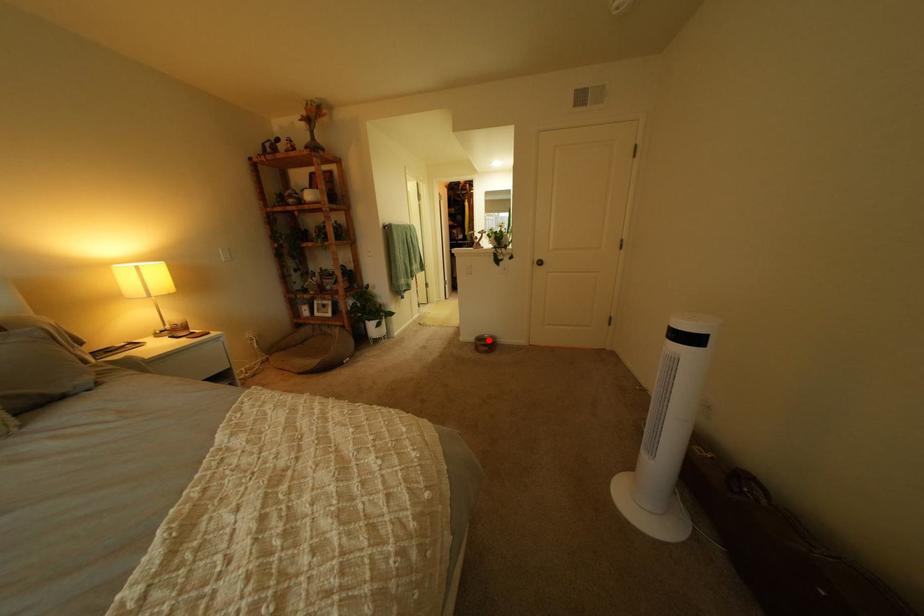
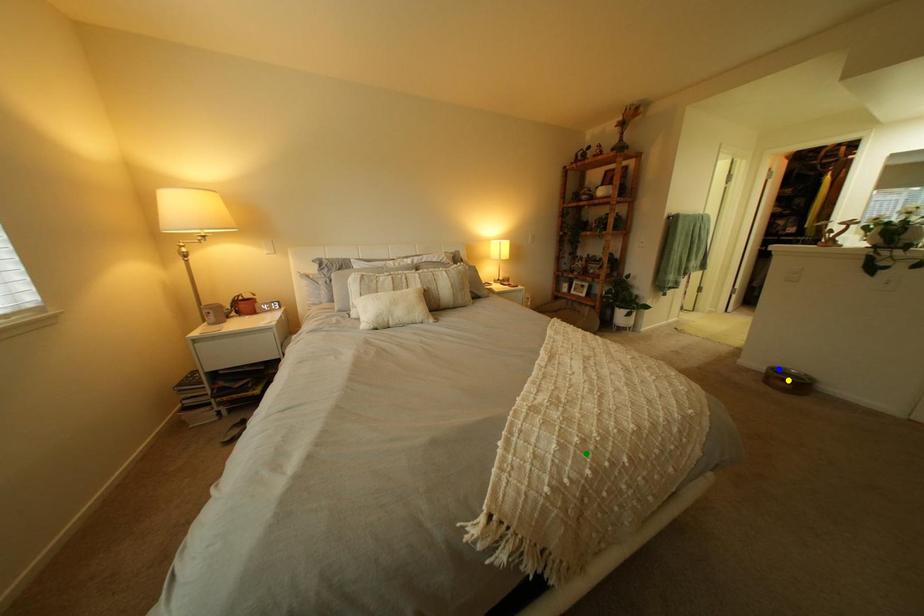
Question: I am providing you with two images of the same scene from different viewpoints. A red point is marked on the first image. You are given multiple points on the second image. In image 2, which mark is for the same physical point as the one in image 1?

Choices:
 (A) green point
 (B) blue point
 (C) yellow point

Answer: (B)